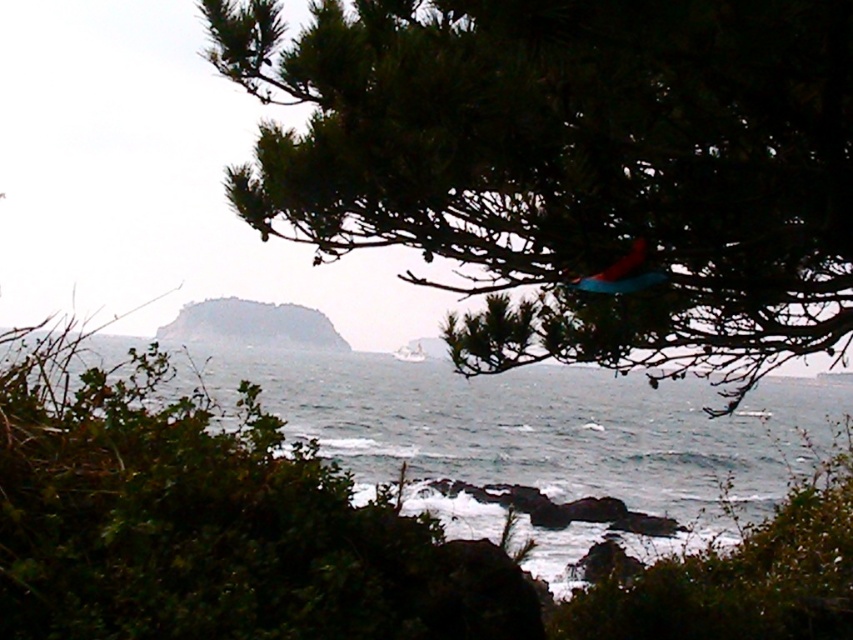
Looking at this image, you are standing in a coastal area and see the dark blue water at center and the matte blue kite at upper center through the tree branches. Which object appears taller in the scene?

The dark blue water at center appears taller than the matte blue kite at upper center in the scene.

You are standing in front of the green matte tree at upper center. You want to place a 2.5 meter long wooden bench between you and the tree. Will the bench fit without overlapping the tree?

The distance between you and the green matte tree at upper center is 3.03 meters. Since the bench is 2.5 meters long, there is enough space to place it without overlapping the tree.

You are standing in the coastal scene and notice a point marked at coordinates (x=572, y=164). What object is located at this point?

The green matte tree at upper center is located at point (x=572, y=164).